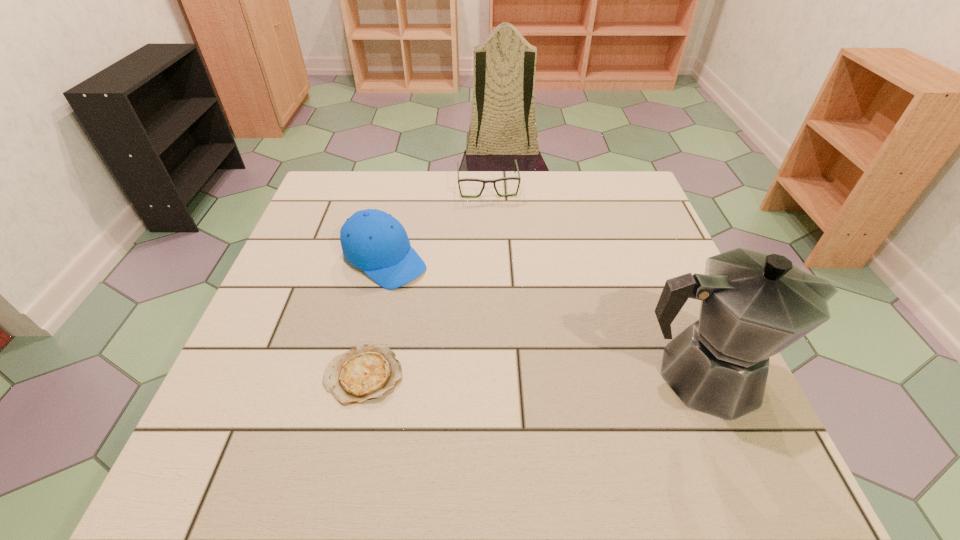
This screenshot has height=540, width=960. What are the coordinates of `vacant space that satisfies the following two spatial constraints: 1. on the back side of the spectacles; 2. on the left side of the quiche` in the screenshot? It's located at (406, 186).

Where is `free spot that satisfies the following two spatial constraints: 1. on the front side of the cap; 2. on the left side of the shortest object`? The image size is (960, 540). free spot that satisfies the following two spatial constraints: 1. on the front side of the cap; 2. on the left side of the shortest object is located at coordinates (358, 375).

Find the location of a particular element. vacant space that satisfies the following two spatial constraints: 1. on the back side of the spectacles; 2. on the left side of the cap is located at coordinates (402, 186).